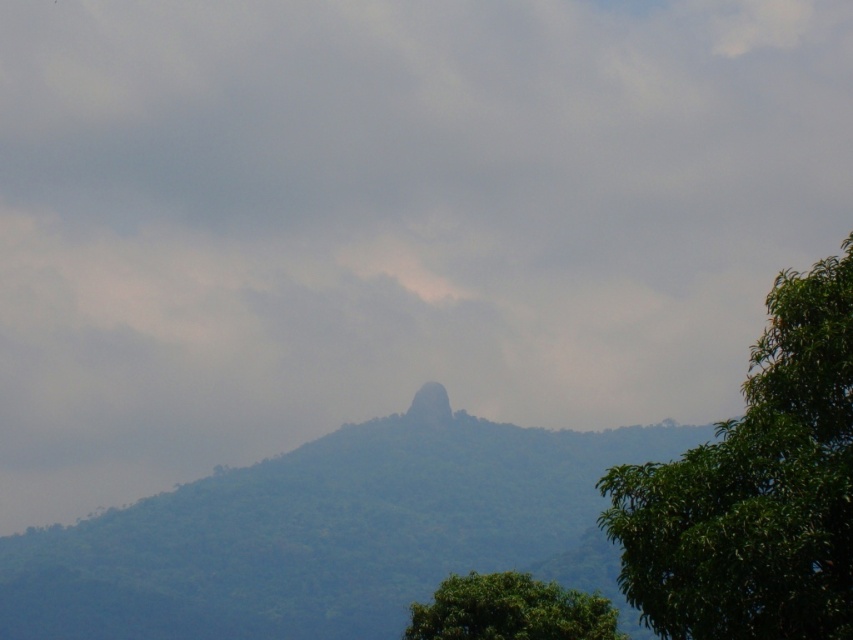
Question: Which of the following is the closest to the observer?

Choices:
 (A) green leafy tree at right
 (B) green leafy mountain at center
 (C) smooth rock at center
 (D) green leafy tree at lower right

Answer: (A)

Question: Does green leafy mountain at center appear under green leafy tree at right?

Choices:
 (A) yes
 (B) no

Answer: (A)

Question: Does green leafy mountain at center have a smaller size compared to smooth rock at center?

Choices:
 (A) no
 (B) yes

Answer: (A)

Question: Which point is closer to the camera?

Choices:
 (A) (416, 397)
 (B) (784, 632)
 (C) (579, 637)

Answer: (B)

Question: Can you confirm if green leafy tree at lower right is wider than smooth rock at center?

Choices:
 (A) yes
 (B) no

Answer: (A)

Question: Which point is farther from the camera taking this photo?

Choices:
 (A) (428, 401)
 (B) (451, 605)
 (C) (494, 424)

Answer: (C)